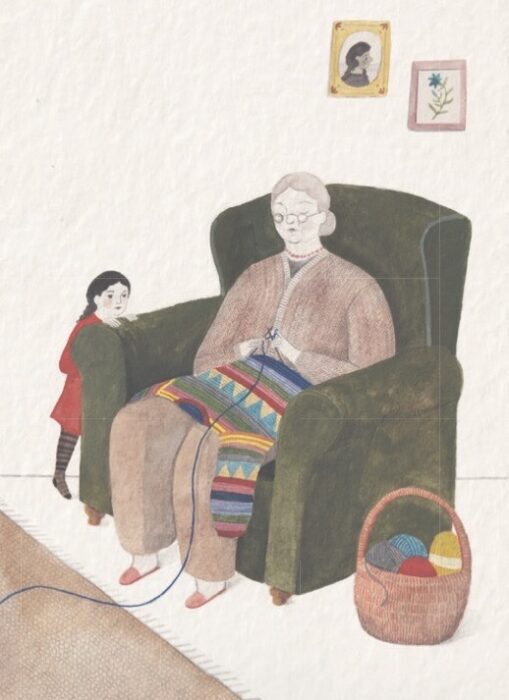
Identify the location of basket. The height and width of the screenshot is (700, 509). (418, 617).